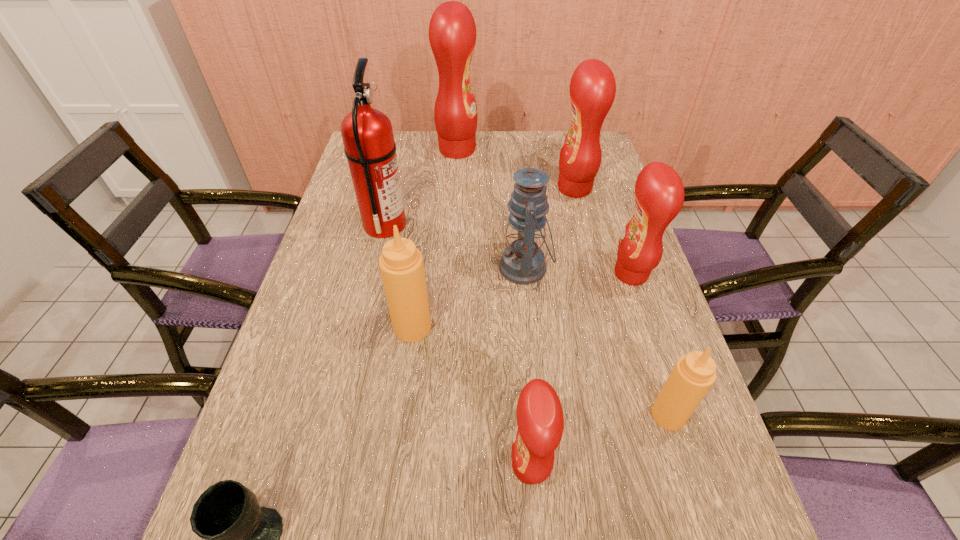
The width and height of the screenshot is (960, 540). I want to click on the right tan condiment, so click(693, 375).

Where is `the nearer tan condiment`? The width and height of the screenshot is (960, 540). the nearer tan condiment is located at coordinates (693, 375).

I want to click on the nearest condiment, so click(540, 419).

I want to click on the fourth condiment from right to left, so click(x=540, y=419).

Where is `vacant position located on the label side of the farthest red condiment`? This screenshot has height=540, width=960. vacant position located on the label side of the farthest red condiment is located at coordinates (580, 150).

Identify the location of free spot located at the nozzle of the fire extinguisher. The image size is (960, 540). [x=442, y=225].

Locate an element on the screen. The width and height of the screenshot is (960, 540). free space located on the label side of the third tallest object is located at coordinates (524, 188).

You are a GUI agent. You are given a task and a screenshot of the screen. Output one action in this format:
    pyautogui.click(x=<x>, y=<y>)
    Task: Click on the vacant region located 0.200m on the label side of the third tallest object
    
    Given the screenshot: What is the action you would take?
    pyautogui.click(x=492, y=188)

Image resolution: width=960 pixels, height=540 pixels. Find the location of `free spot located on the label side of the third tallest object`. free spot located on the label side of the third tallest object is located at coordinates (502, 188).

This screenshot has height=540, width=960. Find the location of `free space located 0.310m on the front of the bigger tan condiment`. free space located 0.310m on the front of the bigger tan condiment is located at coordinates (391, 488).